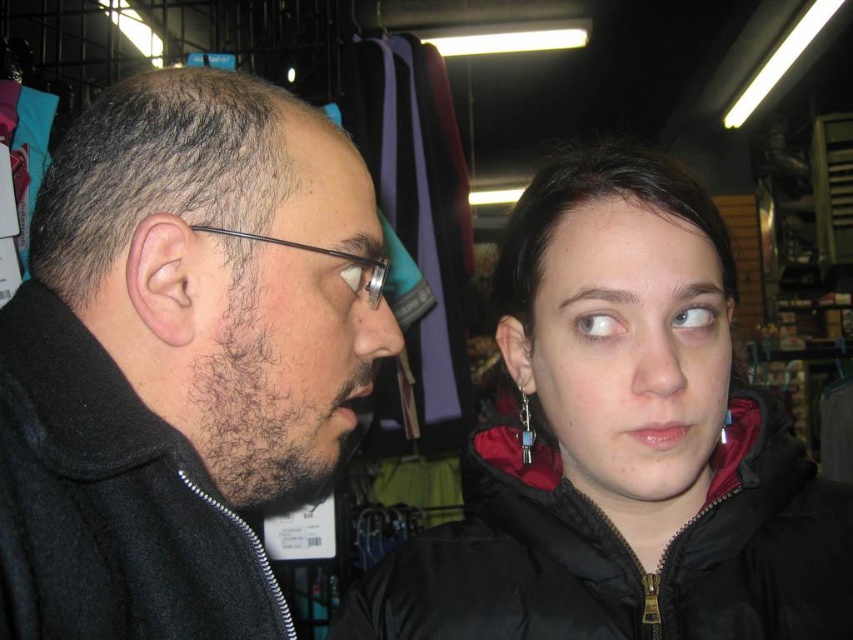
Question: Does dark brown hair at left appear under blue crystal pendant at upper center?

Choices:
 (A) no
 (B) yes

Answer: (A)

Question: Can you confirm if black matte jacket at left is positioned above dark brown hair at upper center?

Choices:
 (A) no
 (B) yes

Answer: (A)

Question: Which of the following is the farthest from the observer?

Choices:
 (A) matte skin forehead at upper center
 (B) matte black jacket at center
 (C) dark brown hair at upper center
 (D) black matte jacket at left

Answer: (C)

Question: From the image, what is the correct spatial relationship of black matte jacket at left in relation to dark brown hair at left?

Choices:
 (A) above
 (B) below

Answer: (B)

Question: Which is farther from the black puffy jacket at center?

Choices:
 (A) dark brown hair at upper center
 (B) black matte jacket at left
 (C) blue crystal pendant at upper center

Answer: (A)

Question: Considering the real-world distances, which object is closest to the matte black jacket at center?

Choices:
 (A) black puffy jacket at center
 (B) blue crystal pendant at upper center

Answer: (A)